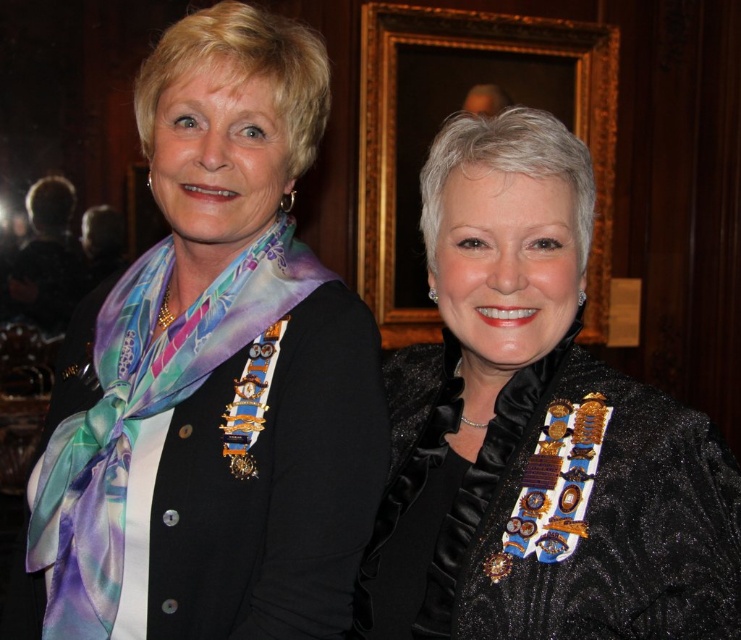
Question: Which object is positioned farthest from the wooden frame at upper center?

Choices:
 (A) silky multicolored scarf at left
 (B) black satin jacket at center

Answer: (B)

Question: Is black satin jacket at center thinner than silky multicolored scarf at left?

Choices:
 (A) yes
 (B) no

Answer: (B)

Question: Which object is the farthest from the wooden frame at upper center?

Choices:
 (A) black satin jacket at center
 (B) silky multicolored scarf at left

Answer: (A)

Question: Which object appears farthest from the camera in this image?

Choices:
 (A) wooden frame at upper center
 (B) silky multicolored scarf at left
 (C) black satin jacket at center

Answer: (A)

Question: Is black satin jacket at center wider than wooden frame at upper center?

Choices:
 (A) yes
 (B) no

Answer: (B)

Question: Can you confirm if wooden frame at upper center is positioned to the right of silky multicolored scarf at left?

Choices:
 (A) yes
 (B) no

Answer: (A)